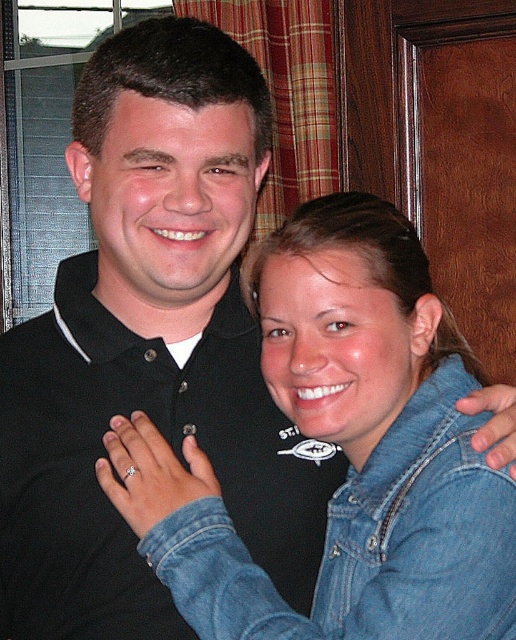
Is point (79, 323) closer to camera compared to point (201, 579)?

No, (79, 323) is behind (201, 579).

Can you confirm if black cotton polo shirt at center is wider than faded denim jacket at lower right?

Yes.

The width and height of the screenshot is (516, 640). Identify the location of black cotton polo shirt at center. (104, 452).